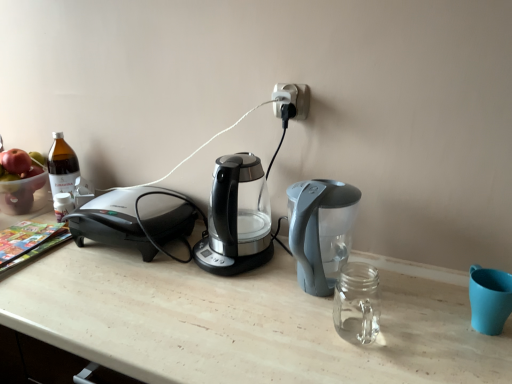
Question: Can you confirm if transparent glass coffee maker at center is positioned to the right of translucent plastic bowl at left?

Choices:
 (A) no
 (B) yes

Answer: (B)

Question: Is transparent glass coffee maker at center positioned beyond the bounds of translucent plastic bowl at left?

Choices:
 (A) no
 (B) yes

Answer: (B)

Question: From the image's perspective, is transparent glass coffee maker at center on top of translucent plastic bowl at left?

Choices:
 (A) yes
 (B) no

Answer: (B)

Question: Does transparent glass coffee maker at center have a greater width compared to translucent plastic bowl at left?

Choices:
 (A) no
 (B) yes

Answer: (B)

Question: Is the position of transparent glass coffee maker at center less distant than that of translucent plastic bowl at left?

Choices:
 (A) no
 (B) yes

Answer: (B)

Question: Is transparent glass coffee maker at center wider or thinner than black plastic plug at upper center?

Choices:
 (A) wide
 (B) thin

Answer: (A)

Question: Is transparent glass coffee maker at center to the left or to the right of black plastic plug at upper center in the image?

Choices:
 (A) right
 (B) left

Answer: (B)

Question: Considering the positions of transparent glass coffee maker at center and black plastic plug at upper center in the image, is transparent glass coffee maker at center taller or shorter than black plastic plug at upper center?

Choices:
 (A) short
 (B) tall

Answer: (B)

Question: From the image's perspective, is transparent glass coffee maker at center located above or below black plastic plug at upper center?

Choices:
 (A) above
 (B) below

Answer: (B)

Question: Relative to translucent plastic bowl at left, is black plastic plug at upper center in front or behind?

Choices:
 (A) behind
 (B) front

Answer: (B)

Question: In terms of size, does black plastic plug at upper center appear bigger or smaller than translucent plastic bowl at left?

Choices:
 (A) small
 (B) big

Answer: (A)

Question: Is black plastic plug at upper center wider or thinner than translucent plastic bowl at left?

Choices:
 (A) wide
 (B) thin

Answer: (B)

Question: Is point (303, 107) positioned closer to the camera than point (24, 190)?

Choices:
 (A) farther
 (B) closer

Answer: (B)

Question: Is black plastic plug at upper center spatially inside transparent glass coffee maker at center, or outside of it?

Choices:
 (A) inside
 (B) outside

Answer: (B)

Question: Looking at the image, does black plastic plug at upper center seem bigger or smaller compared to transparent glass coffee maker at center?

Choices:
 (A) small
 (B) big

Answer: (A)